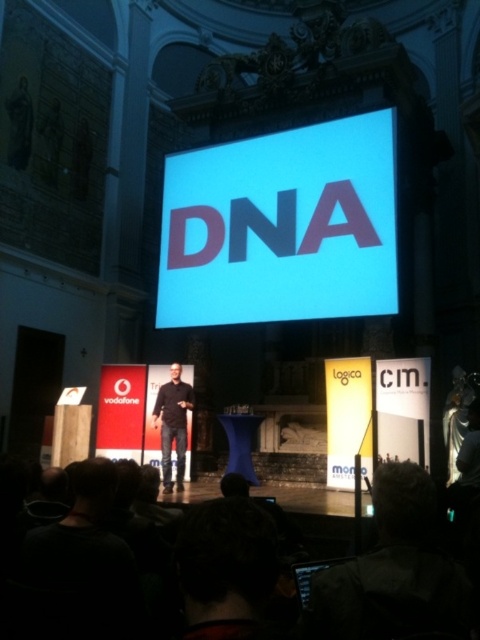
You are an event coordinator checking the stage setup. You need to ensure that the black matte shirt at center is visible to the audience. Given that the white glossy projection screen at center is currently blocking part of its view, how can you adjust their positions to improve visibility?

Since the white glossy projection screen at center is bigger than the black matte shirt at center, you can move the black matte shirt at center to a position where it is not directly behind the larger screen, ensuring it is in a more prominent or unobstructed area of the stage.

You are standing in the grand hall and want to read the text displayed on the white glossy projection screen at center. Considering the distance, is it possible to read the text clearly without moving closer?

The white glossy projection screen at center is 178.01 feet away from the viewer. At this distance, it would be challenging to read the text clearly without moving closer.

You are a photographer trying to capture a closeup of the white glossy projection screen at center and the black matte shirt at center. Since you want both objects in focus, you need to know their relative sizes. Which object is wider?

The white glossy projection screen at center is wider than the black matte shirt at center.